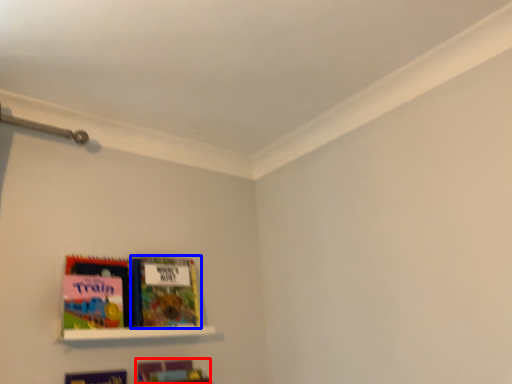
Question: Which of the following is the farthest to the observer, book (highlighted by a red box) or book (highlighted by a blue box)?

Choices:
 (A) book
 (B) book

Answer: (B)